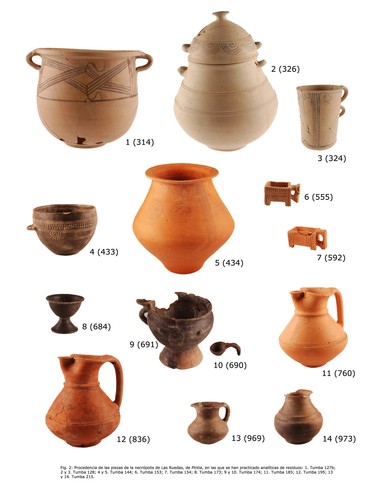
Identify the location of lid on urn in upper center. This screenshot has width=376, height=500. (219, 30).